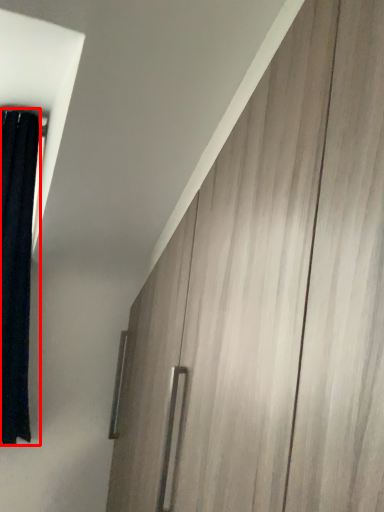
Question: From the image's perspective, considering the relative positions of curtain (annotated by the red box) and barn door in the image provided, where is curtain (annotated by the red box) located with respect to the staircase?

Choices:
 (A) below
 (B) above

Answer: (B)